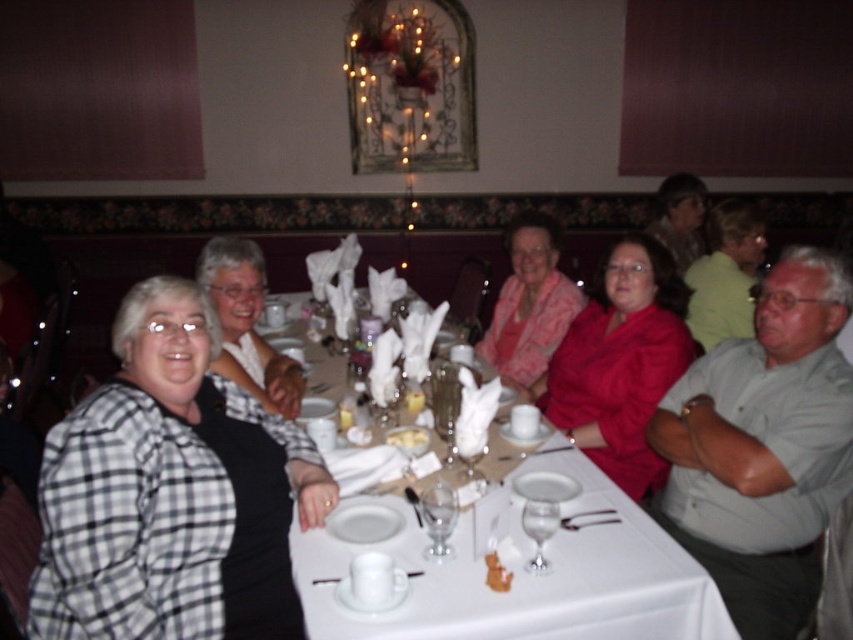
You are a waiter who needs to place a new plate on the table. You see the white porcelain plates at center and the white porcelain plate at center. Which one is directly below the other?

The white porcelain plates at center is positioned under the white porcelain plate at center.

You are a photographer taking a picture of the dining table. You notice a point at coordinates (x=247, y=324). Which object from the scene is this point located on?

The point at coordinates (x=247, y=324) is located on the black checkered shirt at left.

You are a photographer standing at the back of the restaurant. You want to take a group photo of the black checkered shirt at left and matte black hair at upper right. The camera has a minimum focus distance of 8 feet. Will you be able to capture both subjects clearly in the photo?

The black checkered shirt at left is 7.84 feet from matte black hair at upper right. Since the distance between them is less than the camera minimum focus distance of 8 feet, the camera cannot focus on both subjects clearly at the same time.